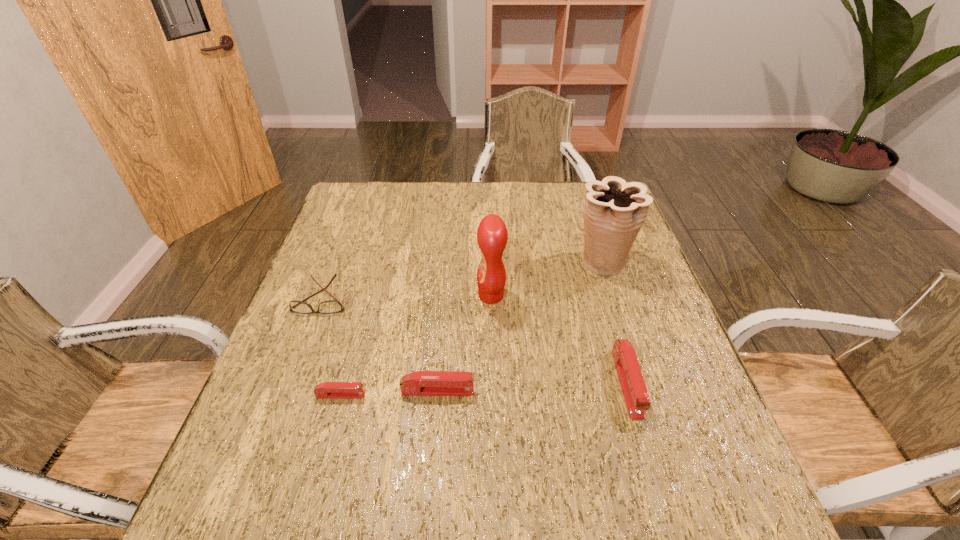
At what (x,y) coordinates should I click in order to perform the action: click on free area in between the third object from right to left and the spectacles. Please return your answer as a coordinate pair (x, y). Looking at the image, I should click on (407, 297).

Find the location of `free space that is in between the shortest stapler and the urn`. free space that is in between the shortest stapler and the urn is located at coordinates (471, 328).

I want to click on free space between the urn and the spectacles, so click(x=462, y=280).

Image resolution: width=960 pixels, height=540 pixels. What are the coordinates of `vacant area between the spectacles and the shortest stapler` in the screenshot? It's located at (331, 347).

Locate an element on the screen. This screenshot has width=960, height=540. vacant area that lies between the shortest stapler and the urn is located at coordinates pyautogui.click(x=471, y=328).

The image size is (960, 540). I want to click on the third closest object to the leftmost stapler, so click(492, 235).

Identify which object is located as the fifth nearest to the shortest stapler. Please provide its 2D coordinates. Your answer should be formatted as a tuple, i.e. [(x, y)], where the tuple contains the x and y coordinates of a point satisfying the conditions above.

[(614, 212)]

The height and width of the screenshot is (540, 960). I want to click on stapler that can be found as the closest to the rightmost stapler, so click(x=421, y=383).

Select which stapler is the second closest to the rightmost stapler. Please provide its 2D coordinates. Your answer should be formatted as a tuple, i.e. [(x, y)], where the tuple contains the x and y coordinates of a point satisfying the conditions above.

[(328, 390)]

I want to click on blank space that satisfies the following two spatial constraints: 1. on the front side of the urn; 2. on the front-facing side of the leftmost stapler, so click(x=643, y=395).